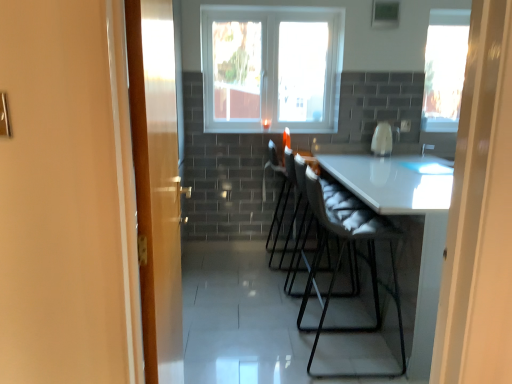
You are a GUI agent. You are given a task and a screenshot of the screen. Output one action in this format:
    pyautogui.click(x=<x>, y=<y>)
    Task: Click on the free space in front of white fabric folding chair at center
    
    Given the screenshot: What is the action you would take?
    pyautogui.click(x=297, y=306)